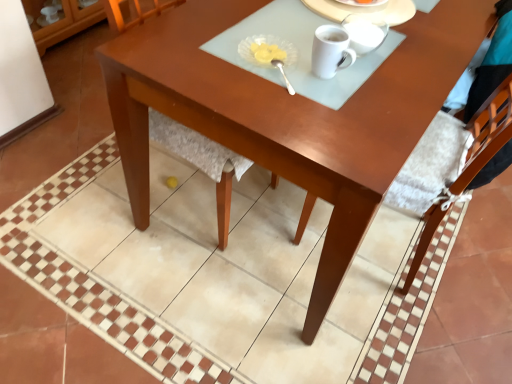
Locate an element on the screen. free spot behind white glossy mug at upper center is located at coordinates (301, 33).